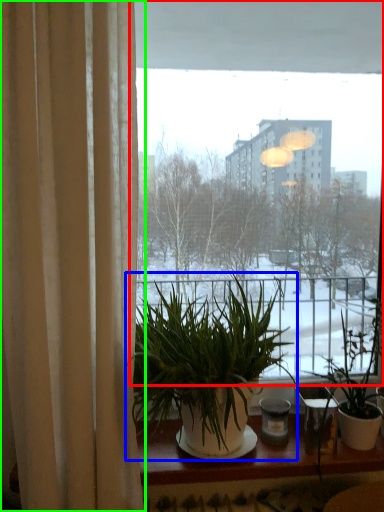
Question: Which object is the farthest from window (highlighted by a red box)? Choose among these: houseplant (highlighted by a blue box) or curtain (highlighted by a green box).

Choices:
 (A) houseplant
 (B) curtain

Answer: (A)